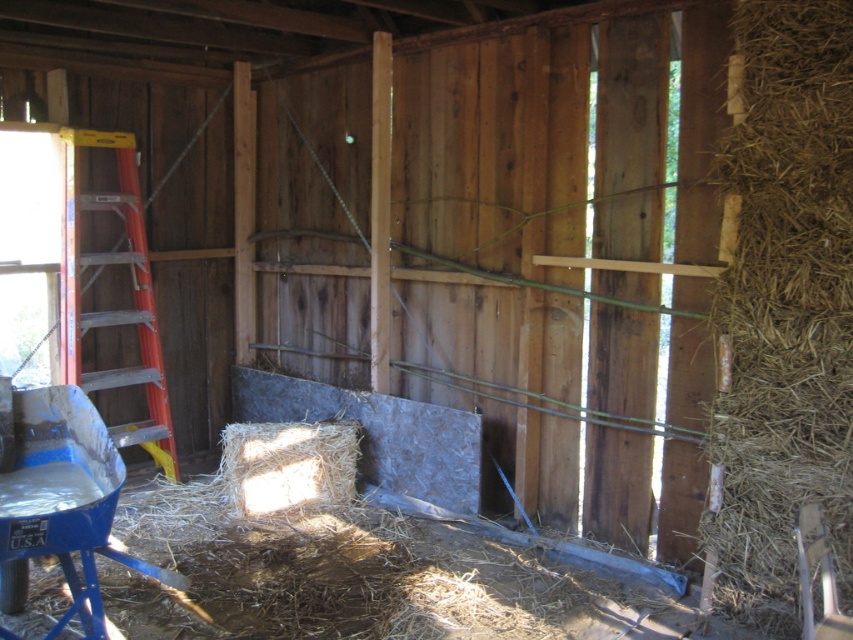
Looking at this image, you are trying to decide whether to place a 1.2 meter wide wooden crate between the brown straw at right and the orange aluminum ladder at left. Based on the image, will there be enough space?

The brown straw at right has a lesser width compared to orange aluminum ladder at left. Since the brown straw at right is narrower than the ladder, the total space between them might be sufficient for the 1.2 meter crate, but the exact dimensions aren